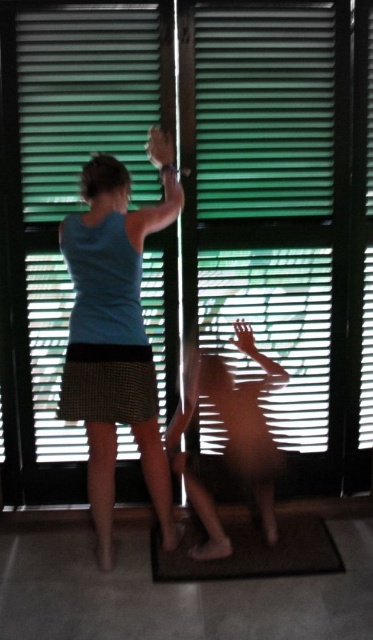
Question: Is green matte blinds at upper center above blue fabric shirt at upper left?

Choices:
 (A) yes
 (B) no

Answer: (A)

Question: Is blue fabric shirt at upper left wider than brown textured mat at lower center?

Choices:
 (A) no
 (B) yes

Answer: (A)

Question: Estimate the real-world distances between objects in this image. Which object is farther from the brown textured mat at lower center?

Choices:
 (A) green matte blinds at upper center
 (B) blue fabric shirt at upper left

Answer: (A)

Question: Does green matte blinds at upper center have a lesser width compared to blue fabric shirt at upper left?

Choices:
 (A) no
 (B) yes

Answer: (A)

Question: Which of the following is the farthest from the observer?

Choices:
 (A) (167, 148)
 (B) (85, 113)
 (C) (186, 570)

Answer: (B)

Question: Which object appears closest to the camera in this image?

Choices:
 (A) green matte blinds at upper center
 (B) brown textured mat at lower center

Answer: (B)